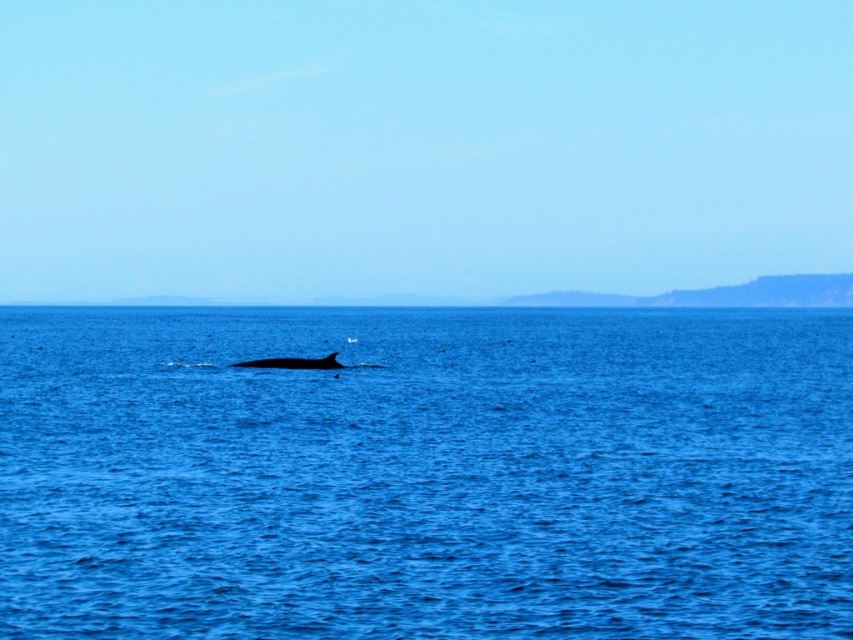
Is blue water at center taller than gray matte whale at center?

Indeed, blue water at center has a greater height compared to gray matte whale at center.

Is blue water at center smaller than gray matte whale at center?

No.

Is point (595, 560) positioned behind point (303, 362)?

No.

Where is `blue water at center`? This screenshot has height=640, width=853. blue water at center is located at coordinates (425, 474).